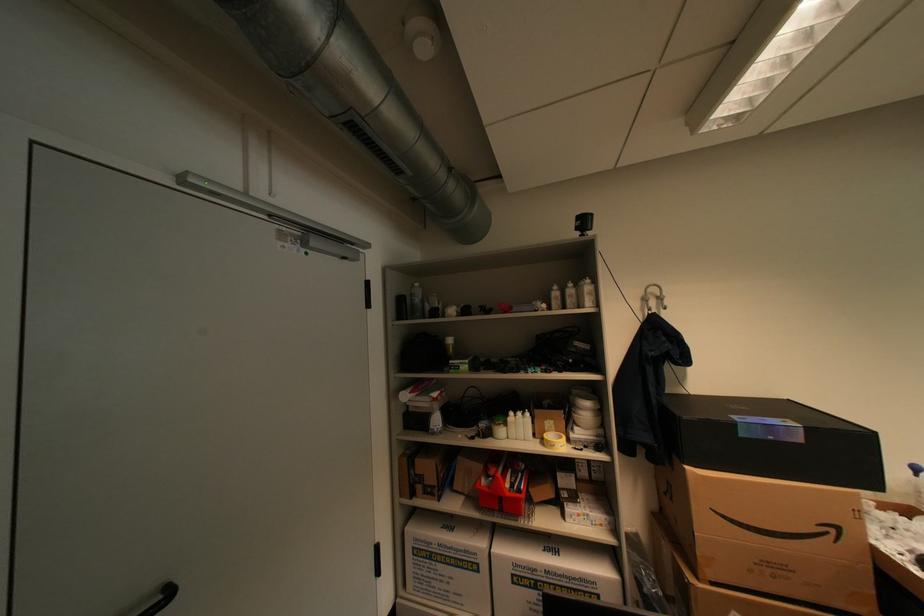
This screenshot has width=924, height=616. I want to click on black cardboard box, so click(772, 440).